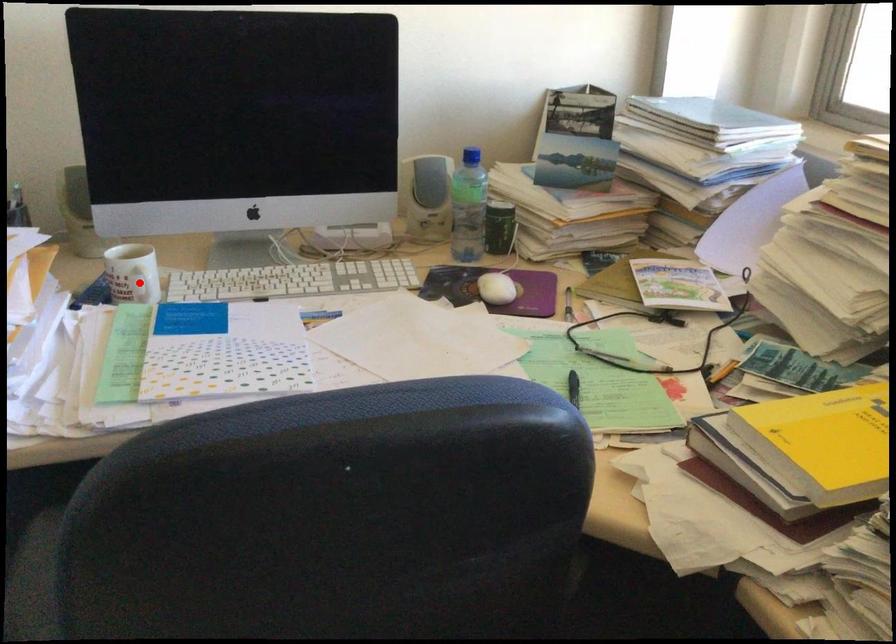
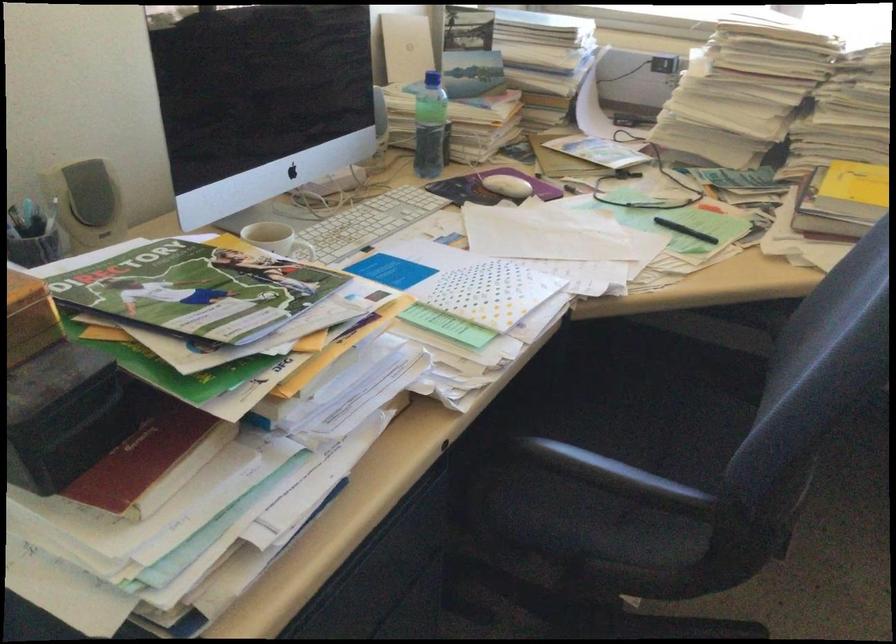
In the second image, find the point that corresponds to the highlighted location in the first image.

(306, 252)